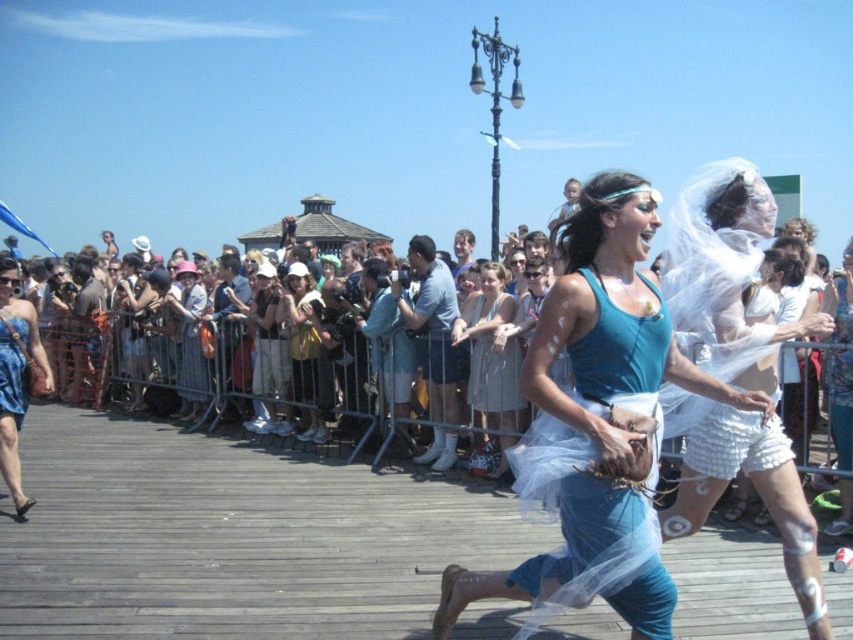
Between teal fabric dress at center and light beige fabric dress at center, which one appears on the right side from the viewer's perspective?

teal fabric dress at center is more to the right.

In order to click on teal fabric dress at center in this screenshot , I will do tap(596, 422).

Is point (146, 529) positioned before point (289, 333)?

Yes, it is.

Does wooden dock at center have a lesser height compared to yellow fabric purse at center?

Correct, wooden dock at center is not as tall as yellow fabric purse at center.

Where is `wooden dock at center`? wooden dock at center is located at coordinates (230, 538).

Does light beige fabric dress at center have a greater width compared to white sheer dress at center?

Indeed, light beige fabric dress at center has a greater width compared to white sheer dress at center.

Which is more to the right, light beige fabric dress at center or white sheer dress at center?

white sheer dress at center

What do you see at coordinates (491, 358) in the screenshot? The width and height of the screenshot is (853, 640). I see `light beige fabric dress at center` at bounding box center [491, 358].

Find the location of a particular element. light beige fabric dress at center is located at coordinates (491, 358).